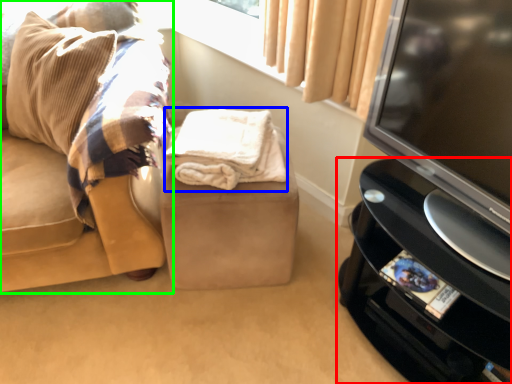
Question: Which object is the closest to the furniture (highlighted by a red box)? Choose among these: blanket (highlighted by a blue box) or studio couch (highlighted by a green box).

Choices:
 (A) blanket
 (B) studio couch

Answer: (A)